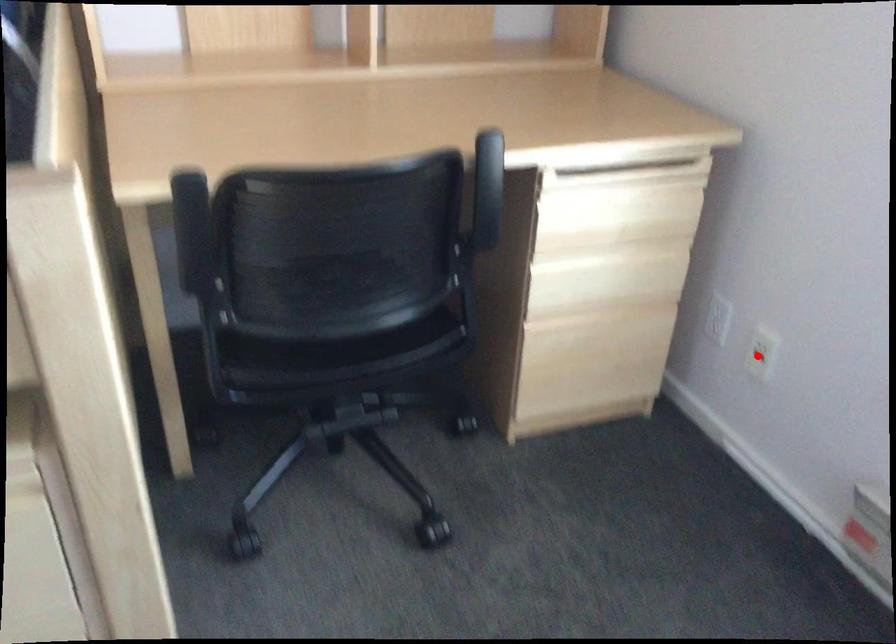
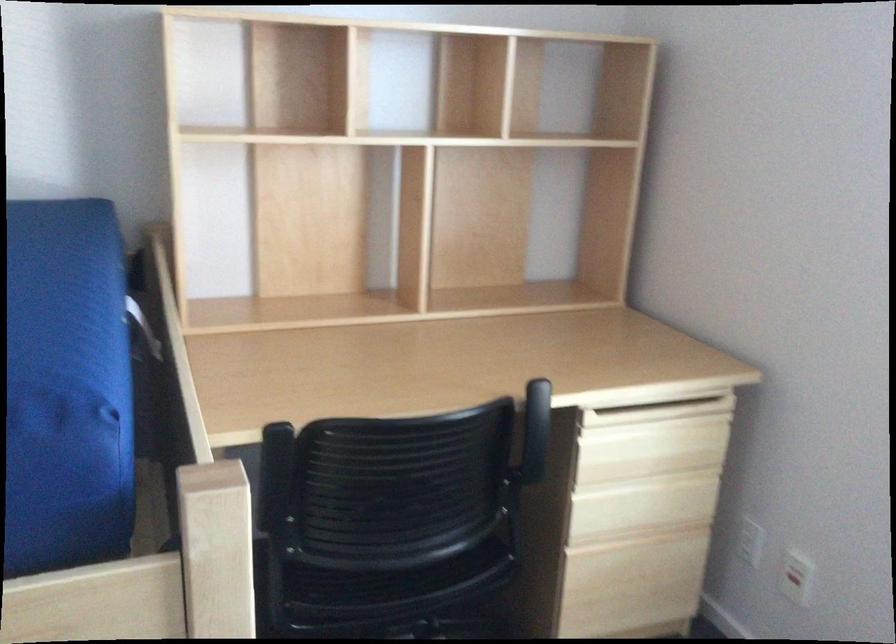
Where in the second image is the point corresponding to the highlighted location from the first image?

(795, 583)